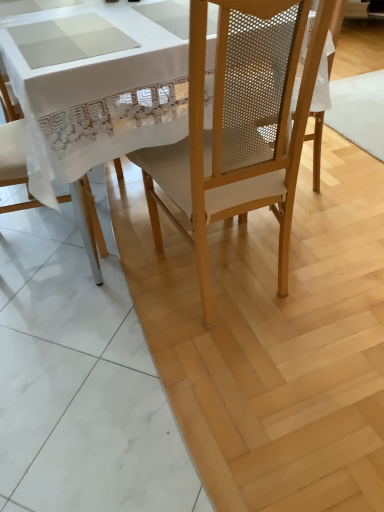
Question: Can you confirm if matte wood chair at center is positioned to the left of white fabric chair at left, which ranks as the first chair in left-to-right order?

Choices:
 (A) yes
 (B) no

Answer: (B)

Question: Considering the relative sizes of matte wood chair at center and white fabric chair at left, which ranks as the first chair in left-to-right order, in the image provided, is matte wood chair at center bigger than white fabric chair at left, which ranks as the first chair in left-to-right order,?

Choices:
 (A) no
 (B) yes

Answer: (B)

Question: Is matte wood chair at center facing away from white fabric chair at left, acting as the 2th chair starting from the right?

Choices:
 (A) no
 (B) yes

Answer: (A)

Question: Is matte wood chair at center far away from white fabric chair at left, acting as the 2th chair starting from the right?

Choices:
 (A) yes
 (B) no

Answer: (B)

Question: Can you confirm if matte wood chair at center is thinner than white fabric chair at left, acting as the 2th chair starting from the right?

Choices:
 (A) no
 (B) yes

Answer: (A)

Question: From a real-world perspective, is matte wood chair at center physically above white fabric chair at left, which ranks as the first chair in left-to-right order?

Choices:
 (A) yes
 (B) no

Answer: (B)

Question: Does matte wood chair at center, the 1th chair when ordered from right to left, touch white fabric chair at left, acting as the 2th chair starting from the right?

Choices:
 (A) no
 (B) yes

Answer: (A)

Question: Is matte wood chair at center, the 1th chair when ordered from right to left, further to camera compared to white fabric chair at left, acting as the 2th chair starting from the right?

Choices:
 (A) yes
 (B) no

Answer: (B)

Question: From a real-world perspective, is matte wood chair at center, the 1th chair when ordered from right to left, on top of white fabric chair at left, acting as the 2th chair starting from the right?

Choices:
 (A) yes
 (B) no

Answer: (A)

Question: From the image's perspective, is matte wood chair at center, the 1th chair when ordered from right to left, located above white fabric chair at left, acting as the 2th chair starting from the right?

Choices:
 (A) no
 (B) yes

Answer: (A)

Question: Is matte wood chair at center, the 1th chair when ordered from right to left, at the right side of white fabric chair at left, acting as the 2th chair starting from the right?

Choices:
 (A) no
 (B) yes

Answer: (B)

Question: Does matte wood chair at center, the 1th chair when ordered from right to left, have a lesser width compared to white fabric chair at left, which ranks as the first chair in left-to-right order?

Choices:
 (A) no
 (B) yes

Answer: (A)

Question: Does white fabric chair at left, acting as the 2th chair starting from the right, have a greater height compared to matte wood chair at center, the 1th chair when ordered from right to left?

Choices:
 (A) no
 (B) yes

Answer: (A)